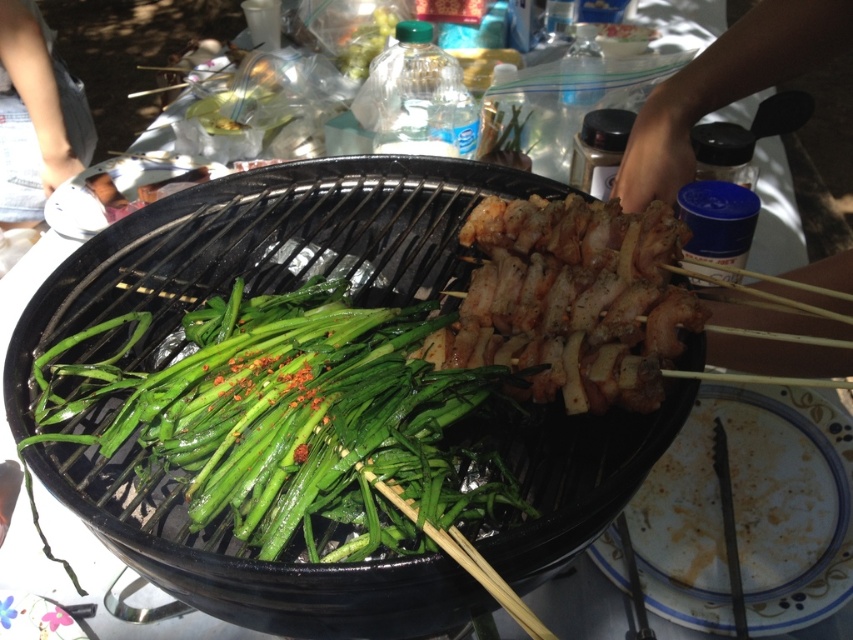
You are a drone operator trying to capture the best aerial shot of the outdoor cooking scene. The camera is currently positioned above the black charcoal grill. To ensure the green glossy vegetables at center are in focus, where should you adjust the camera to point? Please provide coordinates in the format of a point like this example format of point 0.652, 0.341.

The green glossy vegetables at center are located at point (x=289, y=417), so you should adjust the camera to point at that coordinate to focus on them.

You are a food critic standing in front of the grill. You want to describe the arrangement of the green glossy vegetables at center and the grilled meat at center. Which one is placed to the left?

The green glossy vegetables at center is positioned on the left side of grilled meat at center, so the green glossy vegetables at center is placed to the left.

You are planning to place a small plate between the green glossy vegetables at center and the grilled meat at center on the grill. Based on their widths, will the plate fit between them?

The green glossy vegetables at center are wider than the grilled meat at center. Since the vegetables are wider, there might not be enough space for the plate between them unless the plate is smaller than the difference in their widths.